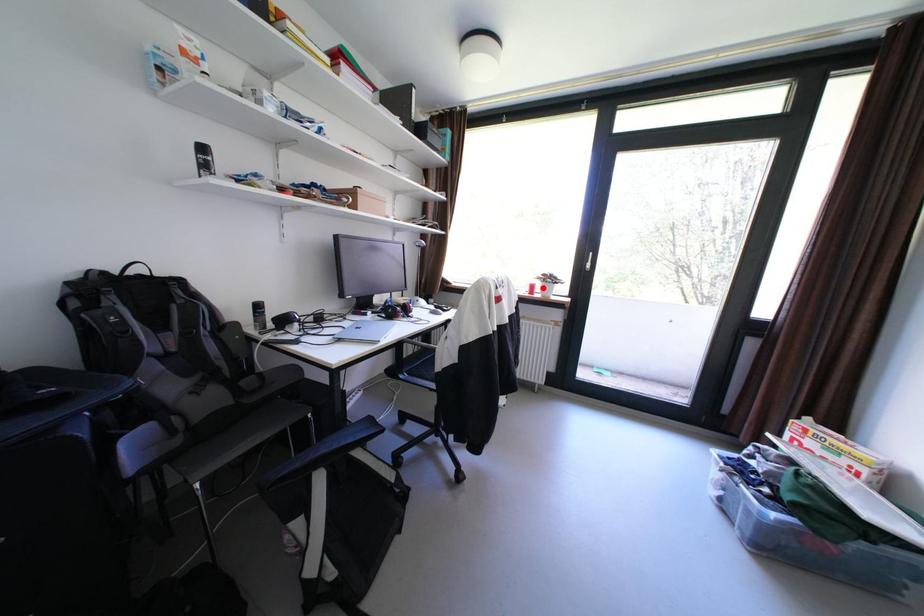
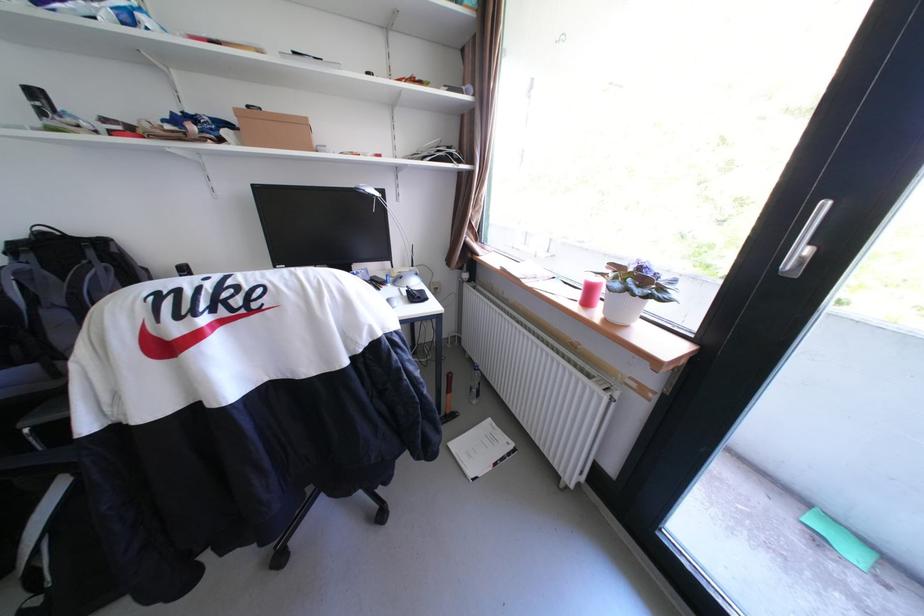
Find the pixel in the second image that matches the highlighted location in the first image.

(601, 291)